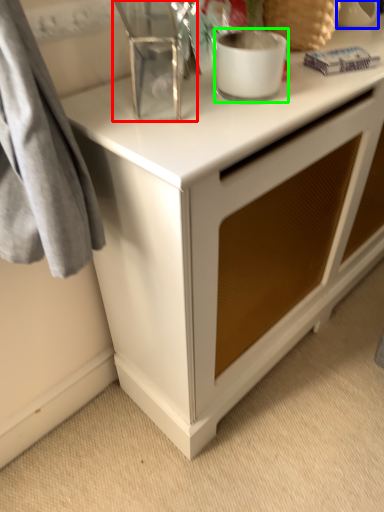
Question: Based on their relative distances, which object is farther from appliance (highlighted by a red box)? Choose from appliance (highlighted by a blue box) and appliance (highlighted by a green box).

Choices:
 (A) appliance
 (B) appliance

Answer: (A)